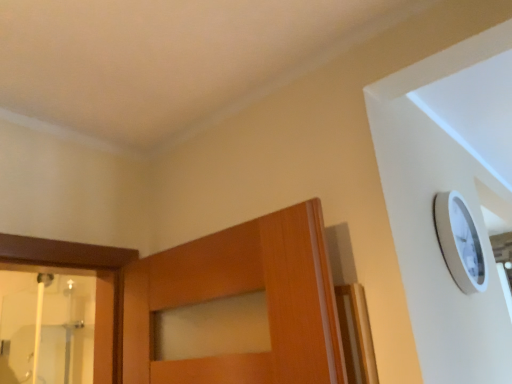
This screenshot has height=384, width=512. Find the location of `white plastic clock at upper right`. white plastic clock at upper right is located at coordinates (459, 242).

What do you see at coordinates (459, 242) in the screenshot? This screenshot has width=512, height=384. I see `white plastic clock at upper right` at bounding box center [459, 242].

What is the approximate height of white plastic clock at upper right?

white plastic clock at upper right is 30.18 centimeters tall.

Measure the distance between point (473,269) and camera.

The depth of point (473,269) is 4.17 feet.

You are a GUI agent. You are given a task and a screenshot of the screen. Output one action in this format:
    pyautogui.click(x=<x>, y=<y>)
    Task: Click on the white plastic clock at upper right
    The width and height of the screenshot is (512, 384).
    Given the screenshot: What is the action you would take?
    pyautogui.click(x=459, y=242)